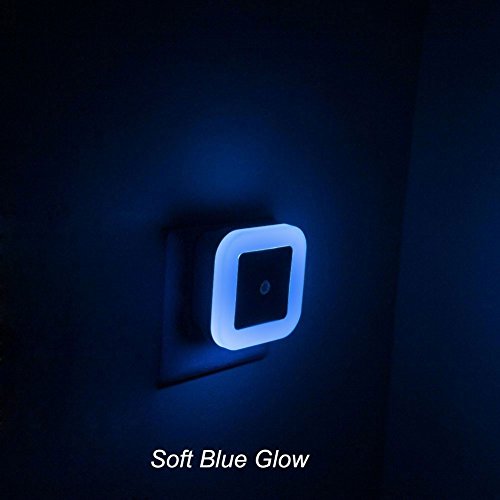
Image resolution: width=500 pixels, height=500 pixels. I want to click on rounded corners, so click(230, 342), click(230, 247), click(294, 233), click(290, 330).